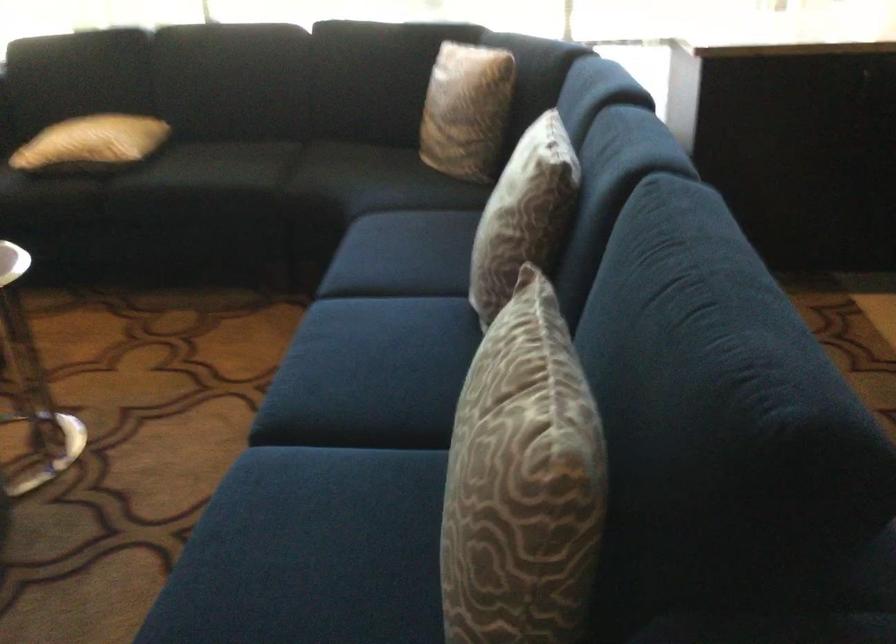
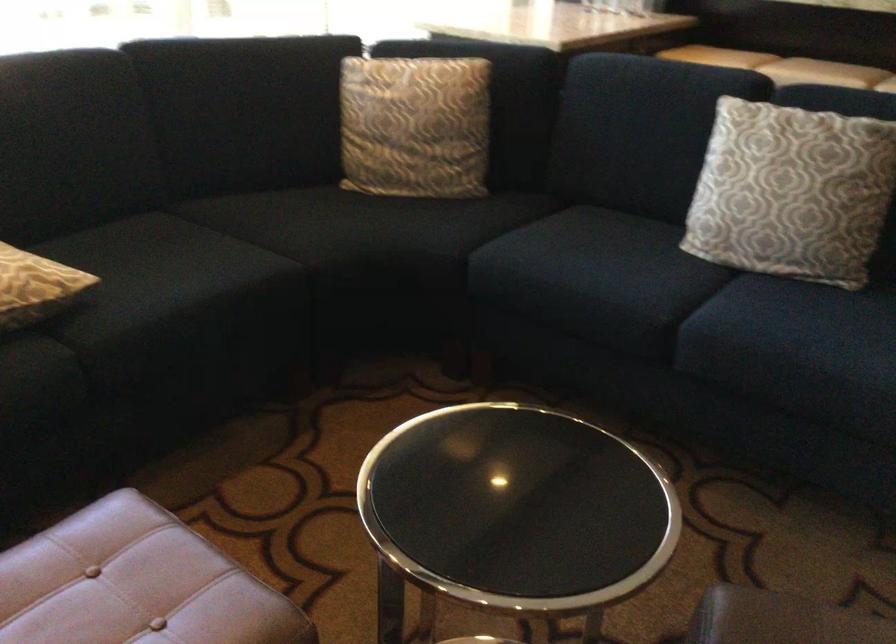
The point at (371,250) is marked in the first image. Where is the corresponding point in the second image?

(590, 274)